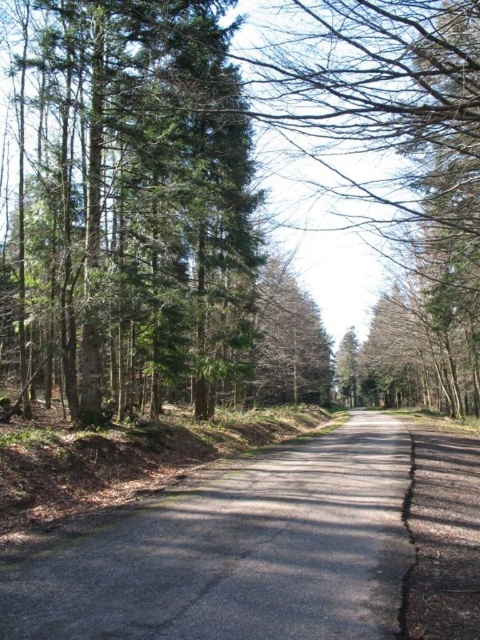
Does green matte tree at left have a greater height compared to smooth asphalt road at center?

Indeed, green matte tree at left has a greater height compared to smooth asphalt road at center.

What do you see at coordinates (140, 173) in the screenshot? I see `green matte tree at left` at bounding box center [140, 173].

Between point (149, 156) and point (330, 474), which one is positioned behind?

The point (149, 156) is more distant.

Locate an element on the screen. This screenshot has height=640, width=480. green matte tree at left is located at coordinates (140, 173).